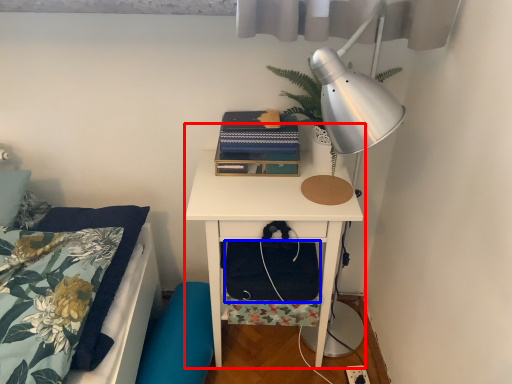
Question: Which of the following is the closest to the observer, nightstand (highlighted by a red box) or footrest (highlighted by a blue box)?

Choices:
 (A) nightstand
 (B) footrest

Answer: (A)